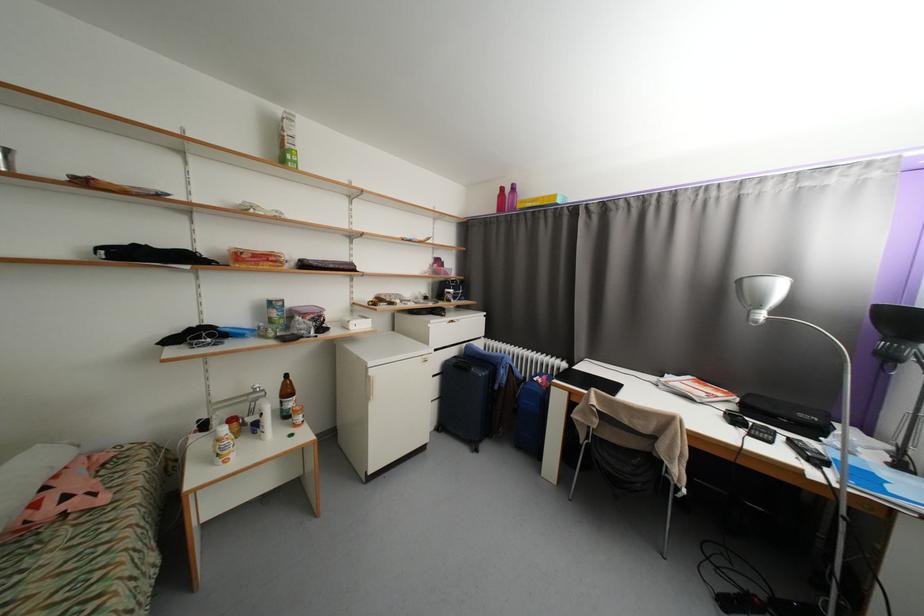
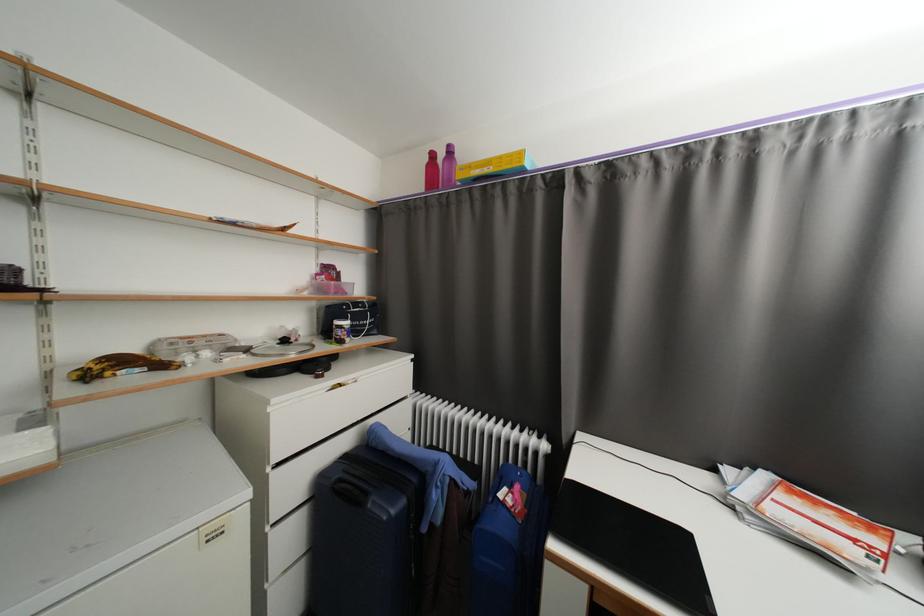
The point at (x=531, y=203) is marked in the first image. Where is the corresponding point in the second image?

(476, 168)